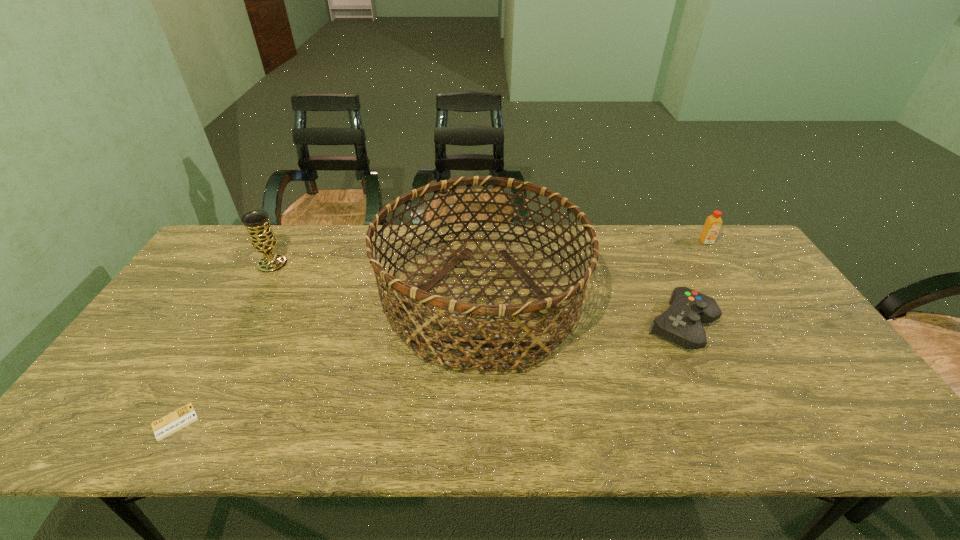
Identify the location of the third object from left to right. (410, 294).

This screenshot has height=540, width=960. In order to click on the tallest object in this screenshot , I will do `click(410, 294)`.

I want to click on the fourth shortest object, so click(262, 238).

You are a GUI agent. You are given a task and a screenshot of the screen. Output one action in this format:
    pyautogui.click(x=<x>, y=<y>)
    Task: Click on the rightmost object
    This screenshot has width=960, height=540.
    Given the screenshot: What is the action you would take?
    pyautogui.click(x=713, y=223)

Find the location of a particular element. The image size is (960, 540). orange juice is located at coordinates (713, 223).

What are the coordinates of `the fourth object from left to right` in the screenshot? It's located at (681, 324).

The image size is (960, 540). I want to click on the second shortest object, so click(x=681, y=324).

Where is `identity card`? identity card is located at coordinates (171, 423).

At what (x,y) coordinates should I click in order to perform the action: click on the shortest object. Please return your answer as a coordinate pair (x, y). Looking at the image, I should click on (171, 423).

Find the location of a particular element. vacant space located on the front of the tallest object is located at coordinates (481, 430).